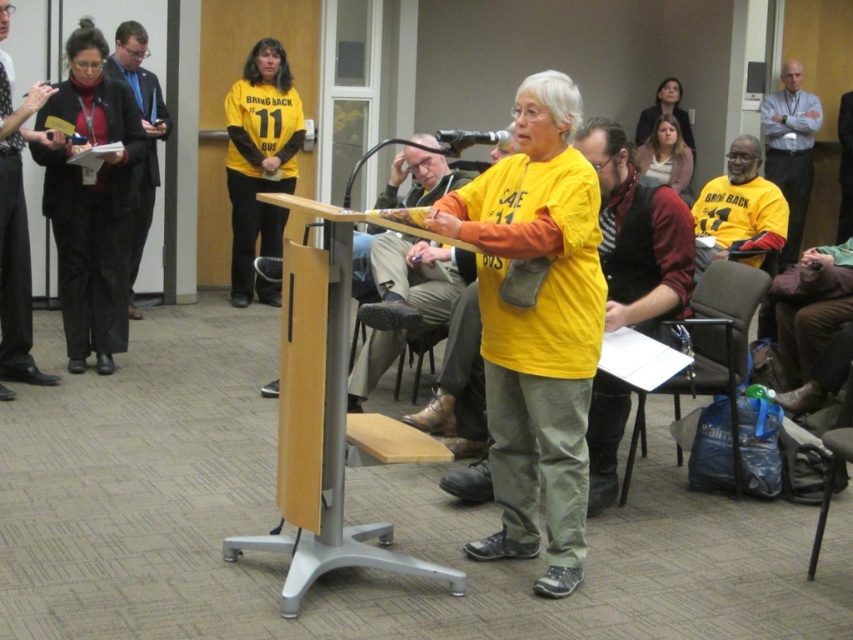
Question: Which object is the farthest from the khaki pants at center?

Choices:
 (A) yellow jersey at right
 (B) black plastic microphone at center
 (C) yellow jersey at center

Answer: (C)

Question: Among these objects, which one is nearest to the camera?

Choices:
 (A) black textured tie at left
 (B) khaki pants at center
 (C) black plastic microphone at center
 (D) gray fabric chair at lower right

Answer: (C)

Question: Is black fabric jacket at left smaller than black plastic microphone at center?

Choices:
 (A) yes
 (B) no

Answer: (B)

Question: Does yellow jersey at center have a lesser width compared to gray fabric chair at lower right?

Choices:
 (A) no
 (B) yes

Answer: (B)

Question: Which point is farther from the camera taking this photo?

Choices:
 (A) (848, 225)
 (B) (403, 154)
 (C) (447, 150)
 (D) (816, 125)

Answer: (A)

Question: Is yellow jersey at center bigger than yellow jersey at right?

Choices:
 (A) no
 (B) yes

Answer: (A)